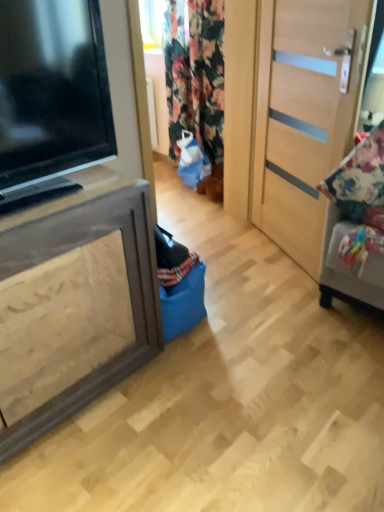
Where is `vacant area to the left of light wood door at right`? The image size is (384, 512). vacant area to the left of light wood door at right is located at coordinates (240, 255).